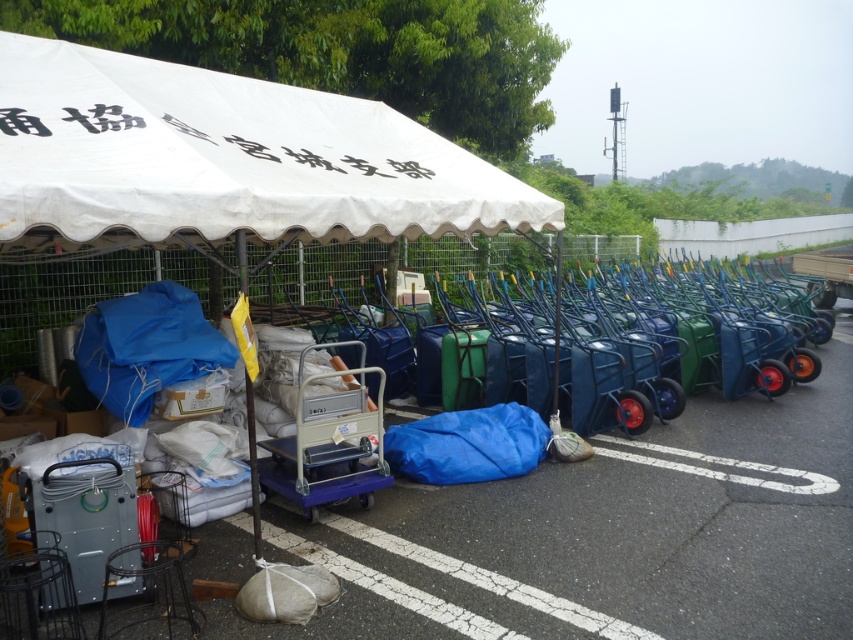
Question: Does white fabric canopy at upper left have a larger size compared to metallic blue cart at center?

Choices:
 (A) no
 (B) yes

Answer: (B)

Question: Does white fabric canopy at upper left lie in front of metallic blue cart at center?

Choices:
 (A) no
 (B) yes

Answer: (B)

Question: Can you confirm if white fabric canopy at upper left is positioned to the left of metallic blue cart at center?

Choices:
 (A) no
 (B) yes

Answer: (B)

Question: Among these objects, which one is farthest from the camera?

Choices:
 (A) white fabric canopy at upper left
 (B) metallic blue cart at center

Answer: (B)

Question: Which point is closer to the camera?

Choices:
 (A) white fabric canopy at upper left
 (B) metallic blue cart at center

Answer: (A)